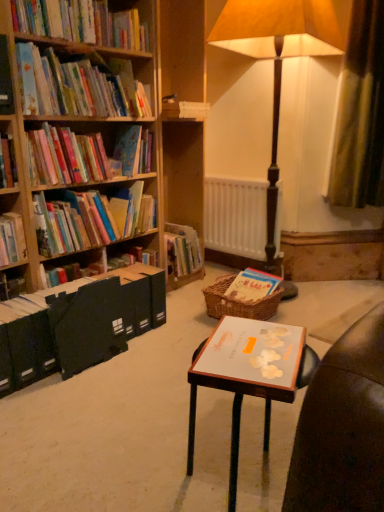
Locate an element on the screen. vacant space to the left of brown woven picnic basket at center is located at coordinates (186, 316).